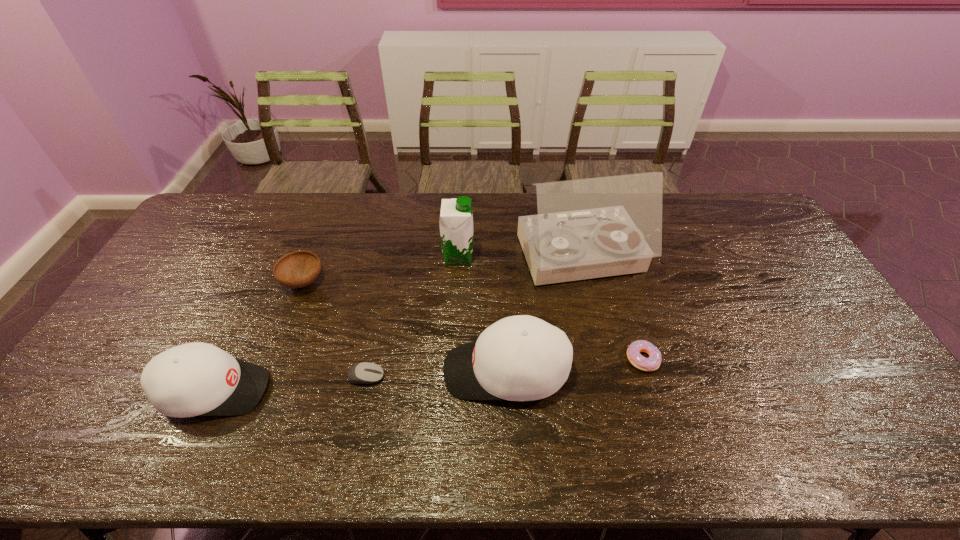
Locate an element on the screen. Image resolution: width=960 pixels, height=540 pixels. free space located 0.400m on the front-facing side of the fifth shortest object is located at coordinates (293, 371).

Find the location of `free space located 0.060m on the front-facing side of the fifth shortest object`. free space located 0.060m on the front-facing side of the fifth shortest object is located at coordinates (420, 371).

At what (x,y) coordinates should I click in order to perform the action: click on vacant region located on the front-facing side of the fifth shortest object. Please return your answer as a coordinate pair (x, y). Looking at the image, I should click on (307, 371).

At what (x,y) coordinates should I click in order to perform the action: click on vacant space located on the right of the bowl. Please return your answer as a coordinate pair (x, y). Image resolution: width=960 pixels, height=540 pixels. Looking at the image, I should click on (448, 282).

The height and width of the screenshot is (540, 960). I want to click on free space located 0.290m on the front of the record player, so click(609, 380).

The image size is (960, 540). Find the location of `vacant point located 0.340m on the front-facing side of the sixth shortest object`. vacant point located 0.340m on the front-facing side of the sixth shortest object is located at coordinates (576, 258).

Locate an element on the screen. The width and height of the screenshot is (960, 540). free space located 0.380m on the wheel side of the computer equipment is located at coordinates (529, 377).

Where is `vacant space located on the left of the doughnut`? vacant space located on the left of the doughnut is located at coordinates (541, 359).

Locate an element on the screen. Image resolution: width=960 pixels, height=540 pixels. object located at the far edge is located at coordinates (588, 228).

This screenshot has height=540, width=960. In order to click on computer equipment positioned at the near edge in this screenshot , I will do `click(361, 373)`.